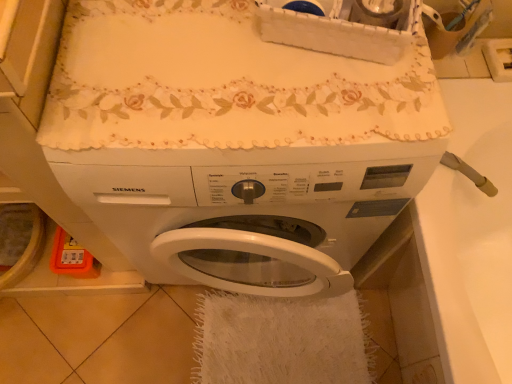
The width and height of the screenshot is (512, 384). Find the location of `vacant area situated below white fluffy bath towel at lower center (from a real-world perspective)`. vacant area situated below white fluffy bath towel at lower center (from a real-world perspective) is located at coordinates (285, 352).